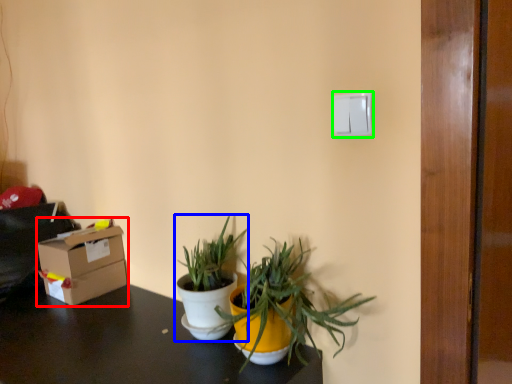
Question: Which object is the farthest from box (highlighted by a red box)? Choose among these: houseplant (highlighted by a blue box) or light switch (highlighted by a green box).

Choices:
 (A) houseplant
 (B) light switch

Answer: (B)